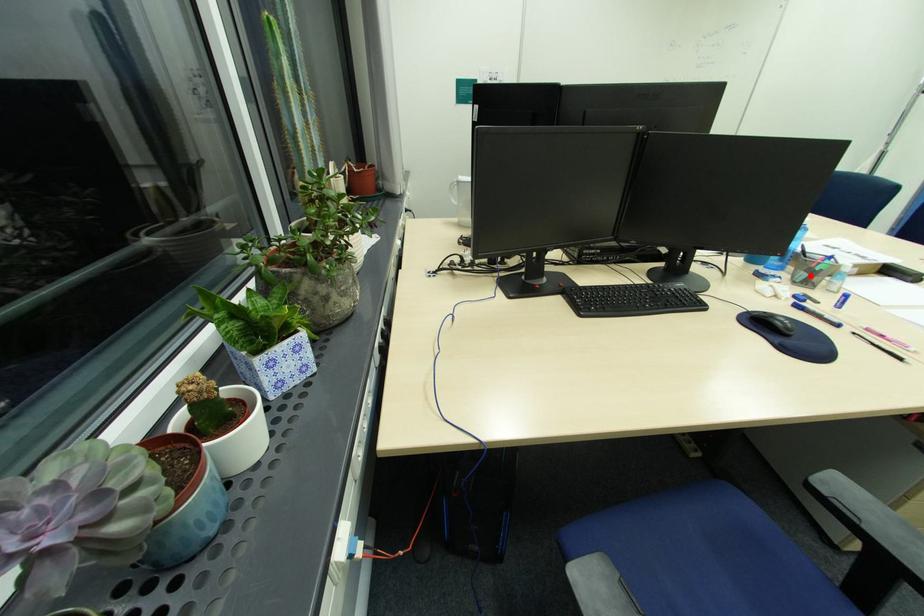
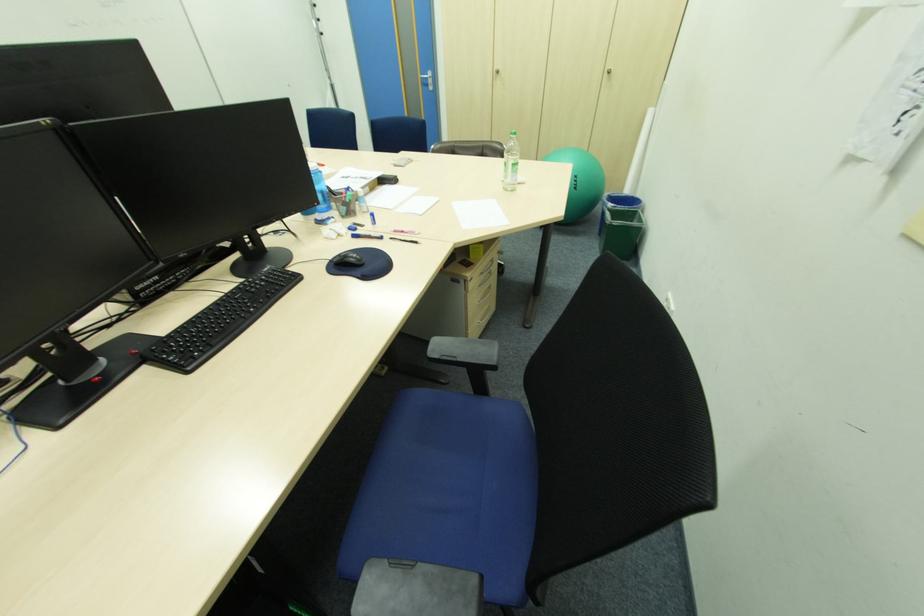
Find the pixel in the second image that matches the highlighted location in the first image.

(349, 209)